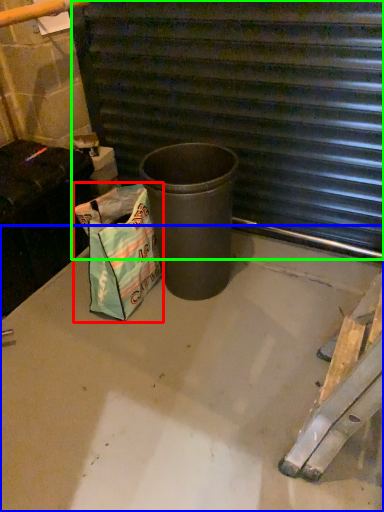
Question: Estimate the real-world distances between objects in this image. Which object is closer to shopping bag (highlighted by a red box), concrete (highlighted by a blue box) or stairwell (highlighted by a green box)?

Choices:
 (A) concrete
 (B) stairwell

Answer: (A)